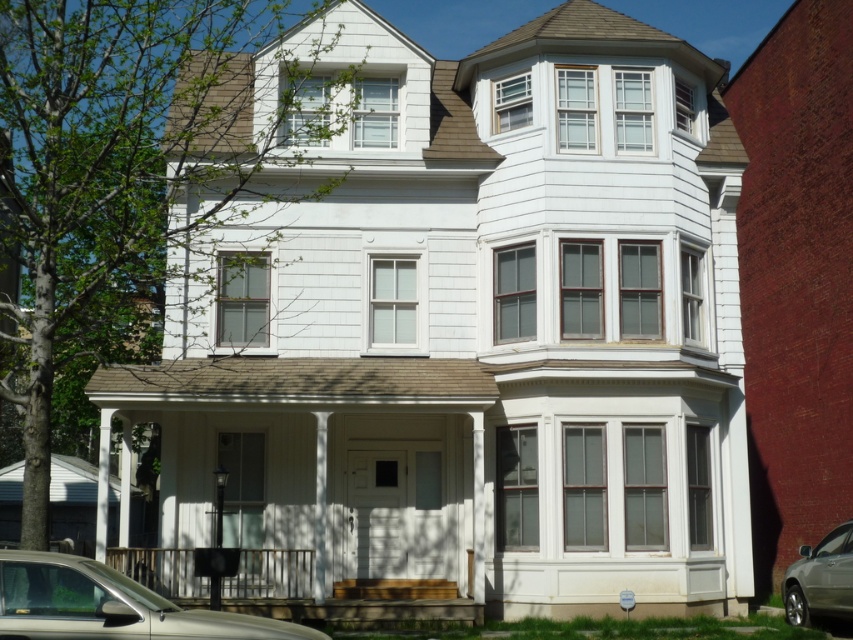
Who is positioned more to the left, metallic silver car at lower left or silver metallic sedan at lower right?

From the viewer's perspective, metallic silver car at lower left appears more on the left side.

Does point (64, 579) lie in front of point (782, 598)?

Yes, it is in front of point (782, 598).

Is point (102, 586) farther from camera compared to point (805, 577)?

No, (102, 586) is in front of (805, 577).

At what (x,y) coordinates should I click in order to perform the action: click on metallic silver car at lower left. Please return your answer as a coordinate pair (x, y). The image size is (853, 640). Looking at the image, I should click on (109, 605).